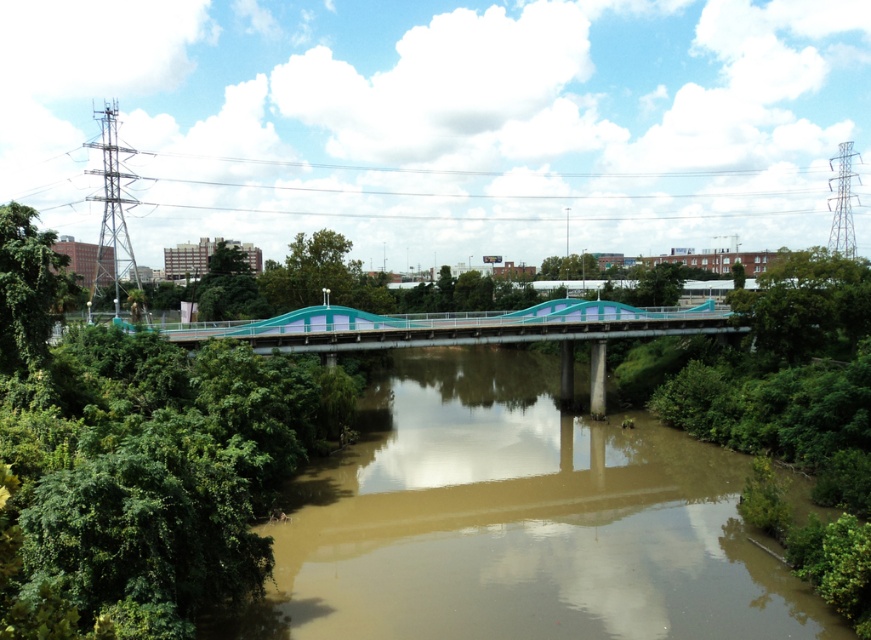
Question: Is green leafy tree at left closer to camera compared to green leafy tree at center?

Choices:
 (A) no
 (B) yes

Answer: (B)

Question: Based on their relative distances, which object is nearer to the green leafy tree at center?

Choices:
 (A) brown muddy water at center
 (B) green leafy tree at left

Answer: (A)

Question: Can you confirm if green leafy tree at left is positioned below green leafy tree at center?

Choices:
 (A) yes
 (B) no

Answer: (A)

Question: Which is farther from the brown muddy water at center?

Choices:
 (A) green leafy tree at center
 (B) green leafy tree at left

Answer: (A)

Question: Can you confirm if brown muddy water at center is positioned below green leafy tree at left?

Choices:
 (A) yes
 (B) no

Answer: (A)

Question: Among these objects, which one is farthest from the camera?

Choices:
 (A) brown muddy water at center
 (B) green leafy tree at left
 (C) green leafy tree at center

Answer: (C)